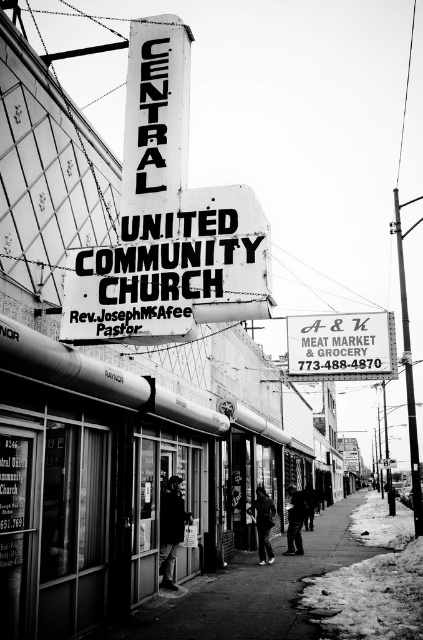
You are a pedestrian standing on the smooth concrete sidewalk at center. Looking ahead, which side should you turn to face the white painted metal sign at center?

The white painted metal sign at center is to the left of the smooth concrete sidewalk at center, so you should turn to your left to face it.

You are a delivery person trying to place a package on the ground near the smooth concrete sidewalk at center and the dark clothing at center. Which object can you place the package on without it being obstructed by the other?

The smooth concrete sidewalk at center is taller than dark clothing at center, so placing the package on the smooth concrete sidewalk at center would prevent it from being obstructed by the dark clothing at center.

You are a delivery person trying to place a heavy box on the ground in the scene. The box is too heavy to lift, so you need to slide it along the ground. Given that the smooth concrete sidewalk at center is larger in size than dark clothing at center, where should you slide the box to ensure it moves smoothly and doesn

The smooth concrete sidewalk at center is larger in size than dark clothing at center, so you should slide the box onto the smooth concrete sidewalk at center because its surface is smoother and provides a better sliding surface compared to the dark clothing at center.